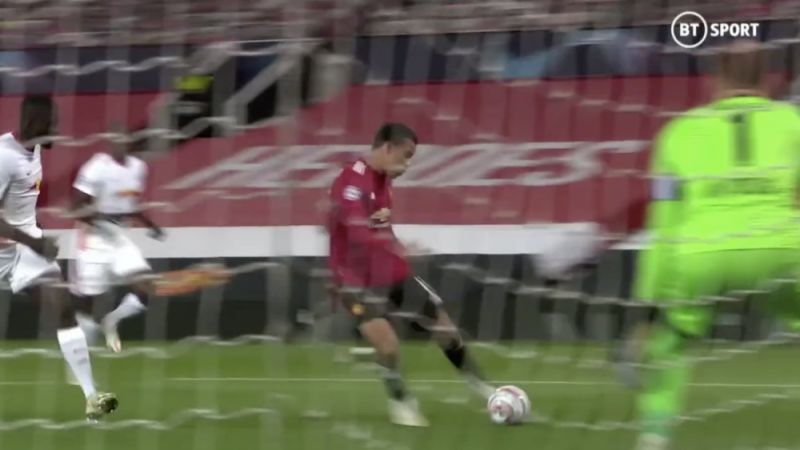
Where is `seating`? seating is located at coordinates (385, 22), (206, 20).